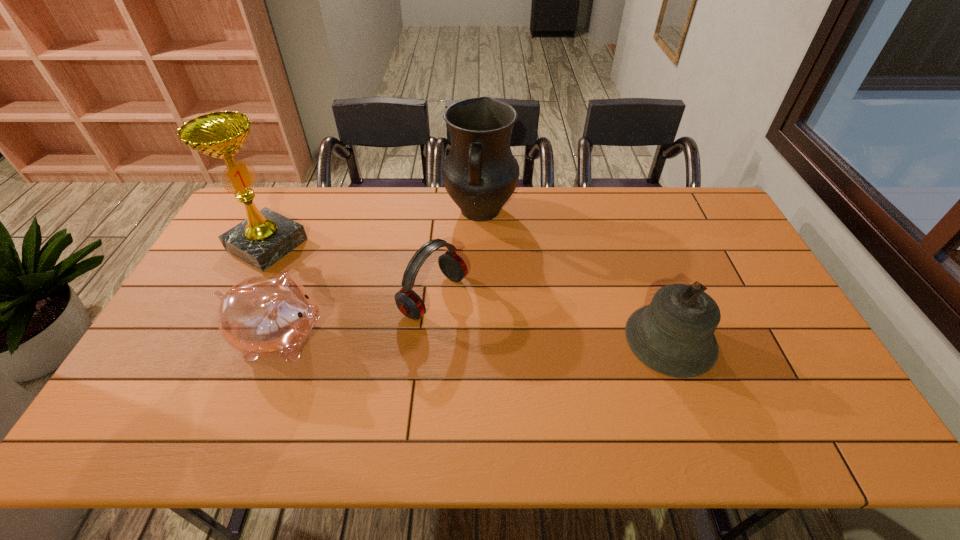
At what (x,y) coordinates should I click in order to perform the action: click on object positioned at the left edge. Please return your answer as a coordinate pair (x, y). Looking at the image, I should click on (266, 236).

Find the location of `object located in the far left corner section of the desktop`. object located in the far left corner section of the desktop is located at coordinates (266, 236).

In the image, there is a desktop. At what (x,y) coordinates should I click in order to perform the action: click on free space at the far edge. Please return your answer as a coordinate pair (x, y). Looking at the image, I should click on (359, 225).

Find the location of a particular element. The width and height of the screenshot is (960, 540). vacant space at the near edge of the desktop is located at coordinates (418, 370).

In the image, there is a desktop. In order to click on vacant space at the left edge in this screenshot , I will do (x=222, y=273).

In the image, there is a desktop. What are the coordinates of `blank space at the right edge` in the screenshot? It's located at (779, 323).

What are the coordinates of `vacant space at the near left corner` in the screenshot? It's located at (186, 392).

At what (x,y) coordinates should I click in order to perform the action: click on free space at the far right corner of the desktop. Please return your answer as a coordinate pair (x, y). This screenshot has height=540, width=960. Looking at the image, I should click on (712, 200).

Image resolution: width=960 pixels, height=540 pixels. Find the location of `vacant space that is in between the award and the pitcher`. vacant space that is in between the award and the pitcher is located at coordinates (373, 228).

At what (x,y) coordinates should I click in order to perform the action: click on free space that is in between the bell and the earphone. Please return your answer as a coordinate pair (x, y). This screenshot has height=540, width=960. Looking at the image, I should click on (552, 318).